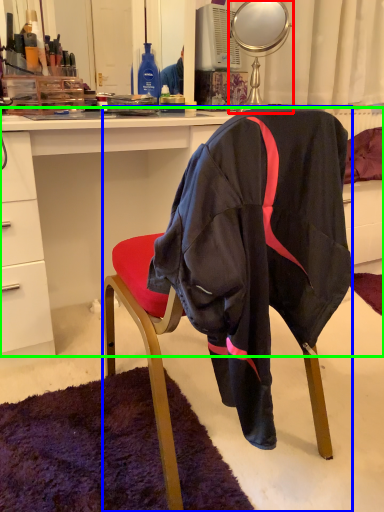
Question: Based on their relative distances, which object is farther from mirror (highlighted by a red box)? Choose from chair (highlighted by a blue box) and desk (highlighted by a green box).

Choices:
 (A) chair
 (B) desk

Answer: (A)